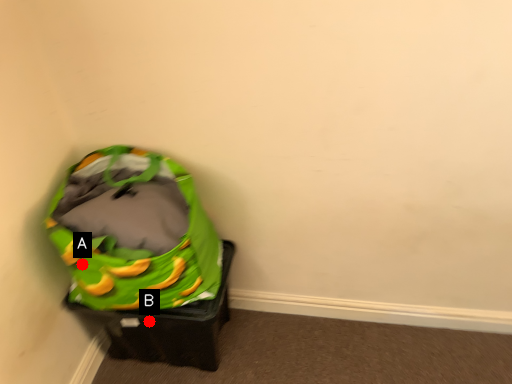
Question: Two points are circled on the image, labeled by A and B beside each circle. Among these points, which one is farthest from the camera?

Choices:
 (A) A is further
 (B) B is further

Answer: (B)